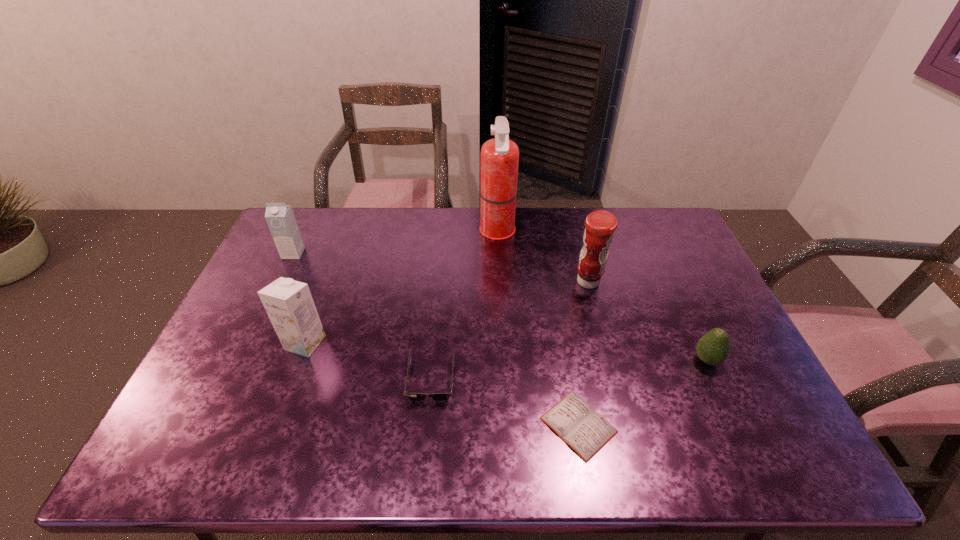
You are a GUI agent. You are given a task and a screenshot of the screen. Output one action in this format:
    pyautogui.click(x=<x>, y=<y>)
    Task: Click on the free space between the third shortest object and the nearer carton
    The image size is (960, 540).
    Given the screenshot: What is the action you would take?
    pyautogui.click(x=506, y=352)

The image size is (960, 540). I want to click on free space between the shortest object and the third farthest object, so click(584, 353).

Locate an element on the screen. unoccupied area between the farther carton and the second shortest object is located at coordinates 362,317.

Identify the location of free spot between the left carton and the sixth tallest object. (362, 317).

Identify the location of empty location between the avocado and the leftmost object. (500, 307).

You are a GUI agent. You are given a task and a screenshot of the screen. Output one action in this format:
    pyautogui.click(x=<x>, y=<y>)
    Task: Click on the vacant space that's between the left carton and the fifth object from right to left
    
    Given the screenshot: What is the action you would take?
    pyautogui.click(x=362, y=317)

Locate an element on the screen. free space between the fifth object from right to left and the fourth object from right to left is located at coordinates (465, 307).

The image size is (960, 540). I want to click on unoccupied position between the leftmost object and the fire extinguisher, so click(x=396, y=243).

This screenshot has width=960, height=540. In order to click on blank region between the tallest object and the condiment in this screenshot , I will do `click(542, 257)`.

Where is `unoccupied position between the farther carton and the second shortest object`? This screenshot has width=960, height=540. unoccupied position between the farther carton and the second shortest object is located at coordinates (362, 317).